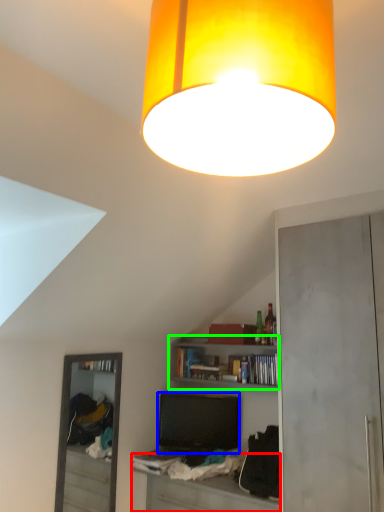
Question: Which object is the farthest from table (highlighted by a red box)? Choose among these: television (highlighted by a blue box) or shelf (highlighted by a green box).

Choices:
 (A) television
 (B) shelf

Answer: (B)